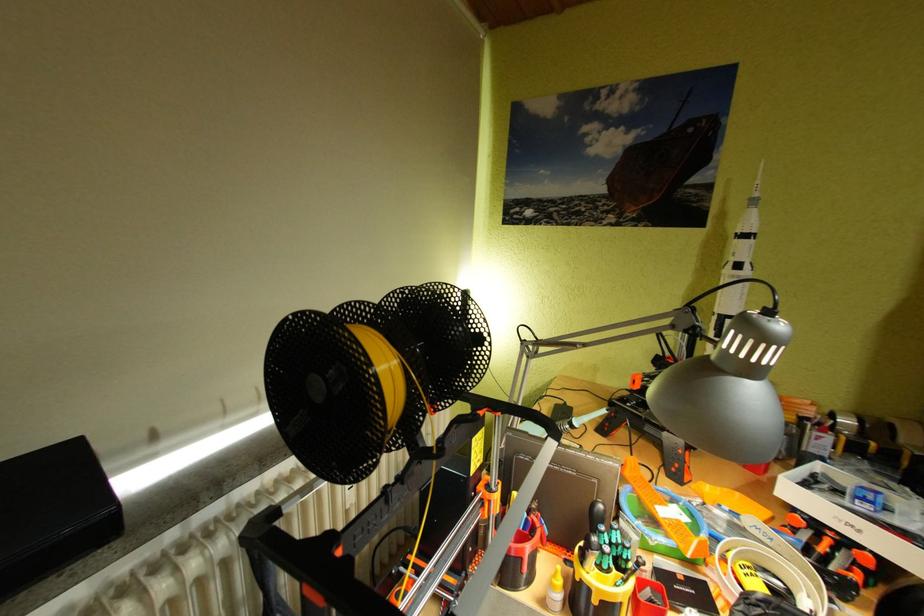
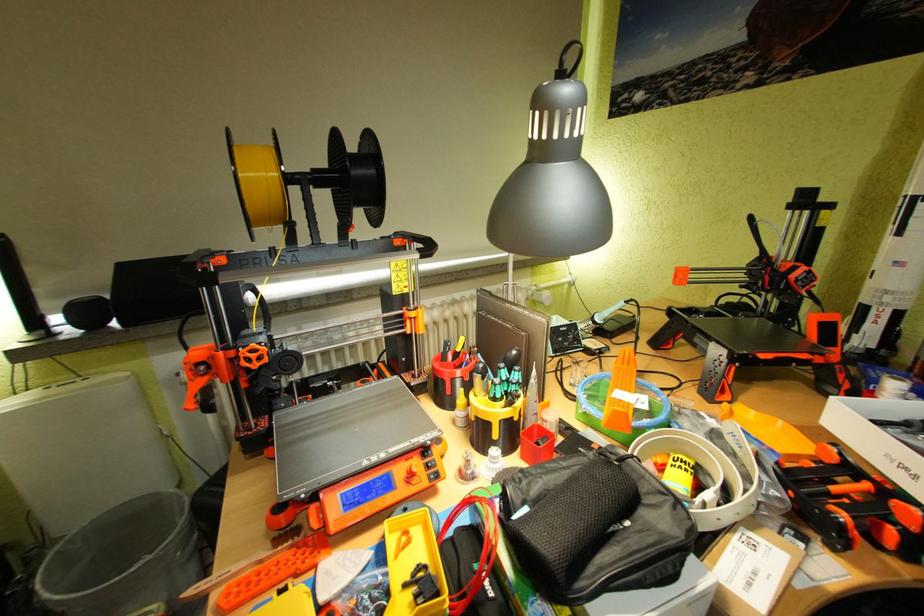
Question: How did the camera likely rotate?

Choices:
 (A) Left
 (B) Right
 (C) Up
 (D) Down

Answer: (A)